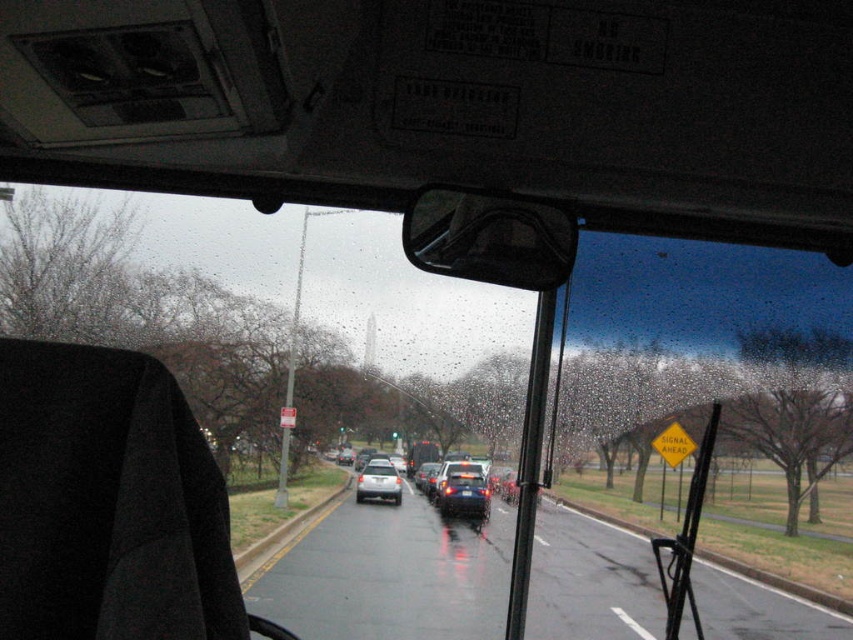
Question: Does matte black sedan at center have a larger size compared to satin silver sedan at center?

Choices:
 (A) yes
 (B) no

Answer: (A)

Question: Does shiny blue sedan at center appear on the right side of black plastic license plate at center?

Choices:
 (A) yes
 (B) no

Answer: (B)

Question: Which is farther from the shiny blue sedan at center?

Choices:
 (A) black plastic license plate at center
 (B) satin silver sedan at center

Answer: (B)

Question: Which point is farther to the camera?

Choices:
 (A) satin silver sedan at center
 (B) shiny blue sedan at center
 (C) black plastic license plate at center
 (D) matte black sedan at center

Answer: (C)

Question: From the image, what is the correct spatial relationship of satin silver sedan at center in relation to metallic silver bus at center?

Choices:
 (A) left
 (B) right

Answer: (A)

Question: Which point is closer to the camera?

Choices:
 (A) (424, 452)
 (B) (479, 500)
 (C) (393, 484)

Answer: (A)